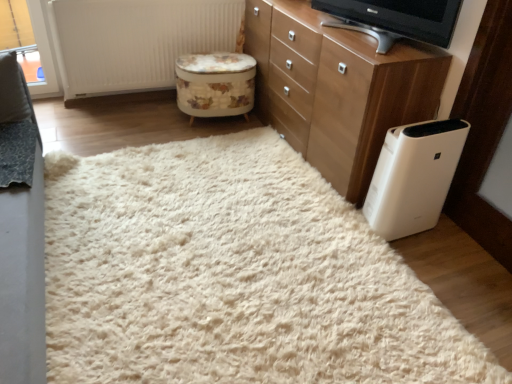
This screenshot has height=384, width=512. Identify the location of white textured radiator at upper center. (135, 41).

What is the approximate height of white textured radiator at upper center?

25.19 inches.

This screenshot has width=512, height=384. In order to click on white fluffy rug at center in this screenshot , I will do `click(232, 275)`.

Image resolution: width=512 pixels, height=384 pixels. I want to click on floral fabric ottoman at center, so click(x=215, y=84).

Describe the element at coordinates (337, 88) in the screenshot. I see `wooden chest of drawers at upper right` at that location.

Describe the element at coordinates (395, 19) in the screenshot. I see `matte black television at upper center` at that location.

Locate an element on the screen. Image resolution: width=512 pixels, height=384 pixels. white textured radiator at upper center is located at coordinates (135, 41).

Would you say white textured radiator at upper center is outside white plastic air purifier at lower right?

Yes, white textured radiator at upper center is located beyond the bounds of white plastic air purifier at lower right.

Is white textured radiator at upper center bigger than white plastic air purifier at lower right?

Indeed, white textured radiator at upper center has a larger size compared to white plastic air purifier at lower right.

Considering their positions, is white textured radiator at upper center located in front of or behind white plastic air purifier at lower right?

white textured radiator at upper center is behind white plastic air purifier at lower right.

From a real-world perspective, is white textured radiator at upper center above or below white plastic air purifier at lower right?

white textured radiator at upper center is above white plastic air purifier at lower right.

Can you confirm if white plastic air purifier at lower right is bigger than floral fabric ottoman at center?

No, white plastic air purifier at lower right is not bigger than floral fabric ottoman at center.

Does white plastic air purifier at lower right lie in front of floral fabric ottoman at center?

Yes.

From a real-world perspective, is white plastic air purifier at lower right physically above floral fabric ottoman at center?

Correct, in the physical world, white plastic air purifier at lower right is higher than floral fabric ottoman at center.

Is wooden chest of drawers at upper right a part of white textured radiator at upper center?

No, wooden chest of drawers at upper right is not a part of white textured radiator at upper center.

In the scene shown: How different are the orientations of white textured radiator at upper center and wooden chest of drawers at upper right in degrees?

The facing directions of white textured radiator at upper center and wooden chest of drawers at upper right are 88.3 degrees apart.

Is white textured radiator at upper center wider than wooden chest of drawers at upper right?

No.

Is point (163, 163) positioned in front of point (245, 59)?

Yes, point (163, 163) is in front of point (245, 59).

Is white fluffy rug at center oriented towards floral fabric ottoman at center?

No, white fluffy rug at center is not facing towards floral fabric ottoman at center.

Who is smaller, white fluffy rug at center or floral fabric ottoman at center?

Smaller between the two is floral fabric ottoman at center.

Does point (86, 261) come closer to viewer compared to point (368, 210)?

Yes, point (86, 261) is in front of point (368, 210).

From the image's perspective, is white fluffy rug at center located above or below white plastic air purifier at lower right?

From the image's perspective, white fluffy rug at center appears below white plastic air purifier at lower right.

Between white fluffy rug at center and white plastic air purifier at lower right, which one is positioned behind?

white plastic air purifier at lower right is further from the camera.

Which is correct: white fluffy rug at center is inside white plastic air purifier at lower right, or outside of it?

white fluffy rug at center is located beyond the bounds of white plastic air purifier at lower right.

From a real-world perspective, is wooden chest of drawers at upper right positioned above or below floral fabric ottoman at center?

Clearly, from a real-world perspective, wooden chest of drawers at upper right is above floral fabric ottoman at center.

Locate an element on the screen. This screenshot has height=384, width=512. the chest of drawers that appears above the floral fabric ottoman at center (from a real-world perspective) is located at coordinates (337, 88).

Considering the positions of objects wooden chest of drawers at upper right and floral fabric ottoman at center in the image provided, who is behind, wooden chest of drawers at upper right or floral fabric ottoman at center?

floral fabric ottoman at center is further away from the camera.

Is wooden chest of drawers at upper right taller or shorter than floral fabric ottoman at center?

In the image, wooden chest of drawers at upper right appears to be taller than floral fabric ottoman at center.

At what (x,y) coordinates should I click in order to perform the action: click on stool that is below the matte black television at upper center (from the image's perspective). Please return your answer as a coordinate pair (x, y). Looking at the image, I should click on (215, 84).

Does floral fabric ottoman at center have a greater width compared to matte black television at upper center?

Correct, the width of floral fabric ottoman at center exceeds that of matte black television at upper center.

Considering the relative sizes of floral fabric ottoman at center and matte black television at upper center in the image provided, is floral fabric ottoman at center taller than matte black television at upper center?

Yes.

Is floral fabric ottoman at center not within matte black television at upper center?

Yes, floral fabric ottoman at center is not within matte black television at upper center.

Find the location of a particular element. Image resolution: width=512 pixels, height=384 pixels. radiator that appears behind the white plastic air purifier at lower right is located at coordinates (135, 41).

Locate an element on the screen. Image resolution: width=512 pixels, height=384 pixels. stool above the white plastic air purifier at lower right (from the image's perspective) is located at coordinates (215, 84).

Which object lies nearer to the anchor point white fluffy rug at center, wooden chest of drawers at upper right or matte black television at upper center?

wooden chest of drawers at upper right is closer to white fluffy rug at center.

Considering their positions, is wooden chest of drawers at upper right positioned closer to white fluffy rug at center than floral fabric ottoman at center?

Among the two, wooden chest of drawers at upper right is located nearer to white fluffy rug at center.

Considering their positions, is wooden chest of drawers at upper right positioned further to white textured radiator at upper center than matte black television at upper center?

Among the two, matte black television at upper center is located further to white textured radiator at upper center.

Which object lies nearer to the anchor point floral fabric ottoman at center, white fluffy rug at center or wooden chest of drawers at upper right?

wooden chest of drawers at upper right.

From the image, which object appears to be nearer to matte black television at upper center, white fluffy rug at center or wooden chest of drawers at upper right?

wooden chest of drawers at upper right.

Considering their positions, is matte black television at upper center positioned closer to white plastic air purifier at lower right than wooden chest of drawers at upper right?

wooden chest of drawers at upper right is closer to white plastic air purifier at lower right.

Based on their spatial positions, is white plastic air purifier at lower right or white fluffy rug at center further from white textured radiator at upper center?

Among the two, white plastic air purifier at lower right is located further to white textured radiator at upper center.

Which object lies further to the anchor point white textured radiator at upper center, white fluffy rug at center or matte black television at upper center?

Based on the image, white fluffy rug at center appears to be further to white textured radiator at upper center.

Where is `home appliance located between white fluffy rug at center and white textured radiator at upper center in the depth direction`? home appliance located between white fluffy rug at center and white textured radiator at upper center in the depth direction is located at coordinates (414, 176).

The height and width of the screenshot is (384, 512). I want to click on the chest of drawers between matte black television at upper center and white fluffy rug at center vertically, so click(337, 88).

Locate an element on the screen. Image resolution: width=512 pixels, height=384 pixels. home appliance located between white fluffy rug at center and wooden chest of drawers at upper right in the depth direction is located at coordinates (414, 176).

This screenshot has width=512, height=384. I want to click on television between white textured radiator at upper center and white plastic air purifier at lower right from left to right, so click(x=395, y=19).